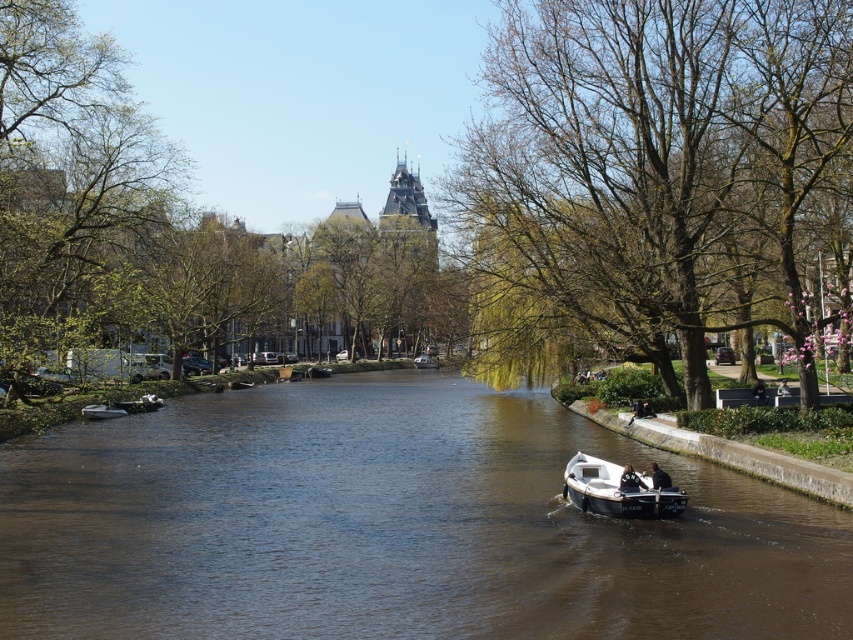
You are a small toy boat that is 1 meter long. You want to sail across the brown smooth water at center and pass by the white matte boat at center. Can your boat fit through the space between them?

The brown smooth water at center might be wider than white matte boat at center, so there is a possibility that the toy boat can fit through the space between them. However, the exact width isn not specified, so caution is advised.